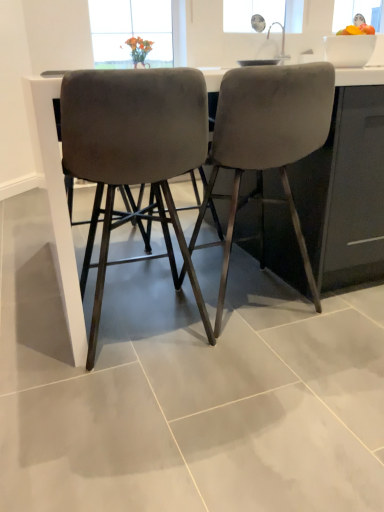
Question: From a real-world perspective, is velvet grey chair at center, the first chair viewed from the left, physically located above or below satin gray barstools at center?

Choices:
 (A) below
 (B) above

Answer: (B)

Question: Is point pyautogui.click(x=112, y=189) closer or farther from the camera than point pyautogui.click(x=46, y=155)?

Choices:
 (A) closer
 (B) farther

Answer: (B)

Question: Considering the real-world distances, which object is farthest from the satin gray barstools at center?

Choices:
 (A) velvet gray chair at center, which is the 1th chair in right-to-left order
 (B) velvet grey chair at center, the first chair viewed from the left

Answer: (A)

Question: Estimate the real-world distances between objects in this image. Which object is farther from the velvet grey chair at center, the first chair viewed from the left?

Choices:
 (A) satin gray barstools at center
 (B) velvet gray chair at center, which is the 2th chair from left to right

Answer: (B)